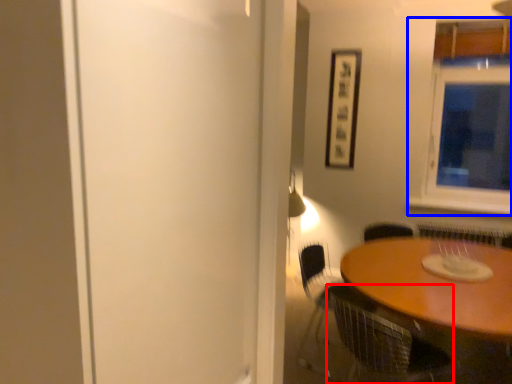
Question: Which object is further to the camera taking this photo, chair (highlighted by a red box) or window (highlighted by a blue box)?

Choices:
 (A) chair
 (B) window

Answer: (B)